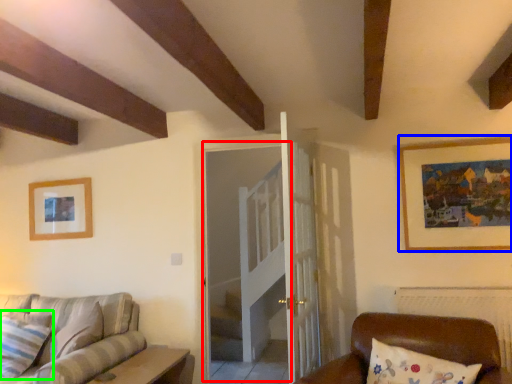
Question: Which object is positioned farthest from glass door (highlighted by a red box)? Select from picture frame (highlighted by a blue box) and pillow (highlighted by a green box).

Choices:
 (A) picture frame
 (B) pillow

Answer: (B)